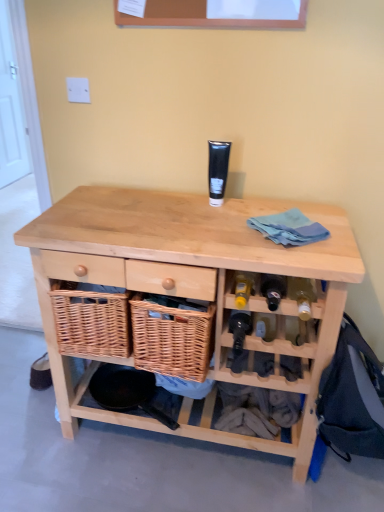
Locate an element on the screen. vacant area in front of black matte tube at center is located at coordinates (215, 220).